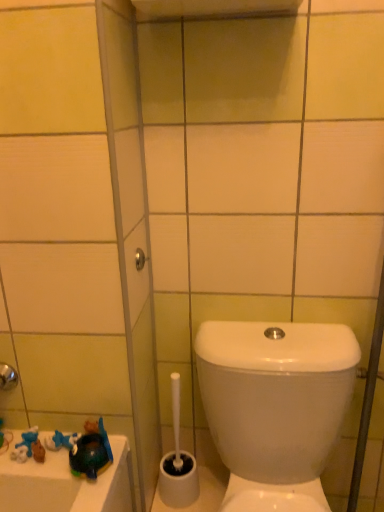
Question: In terms of width, does shiny blue plastic toy at lower left look wider or thinner when compared to white plastic toilet brush at lower center?

Choices:
 (A) thin
 (B) wide

Answer: (A)

Question: In terms of height, does shiny blue plastic toy at lower left look taller or shorter compared to white plastic toilet brush at lower center?

Choices:
 (A) short
 (B) tall

Answer: (A)

Question: Estimate the real-world distances between objects in this image. Which object is closer to the matte silver showerhead at upper center?

Choices:
 (A) shiny blue plastic toy at lower left
 (B) white glossy toilet at lower right
 (C) white plastic toilet brush at lower center

Answer: (A)

Question: Estimate the real-world distances between objects in this image. Which object is closer to the white glossy toilet at lower right?

Choices:
 (A) white plastic toilet brush at lower center
 (B) matte silver showerhead at upper center
 (C) shiny blue plastic toy at lower left

Answer: (A)